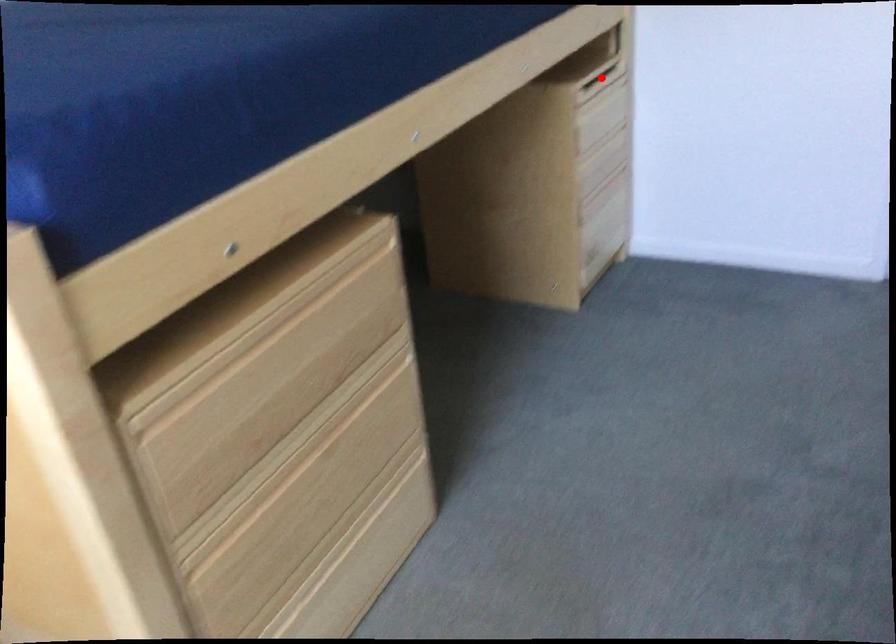
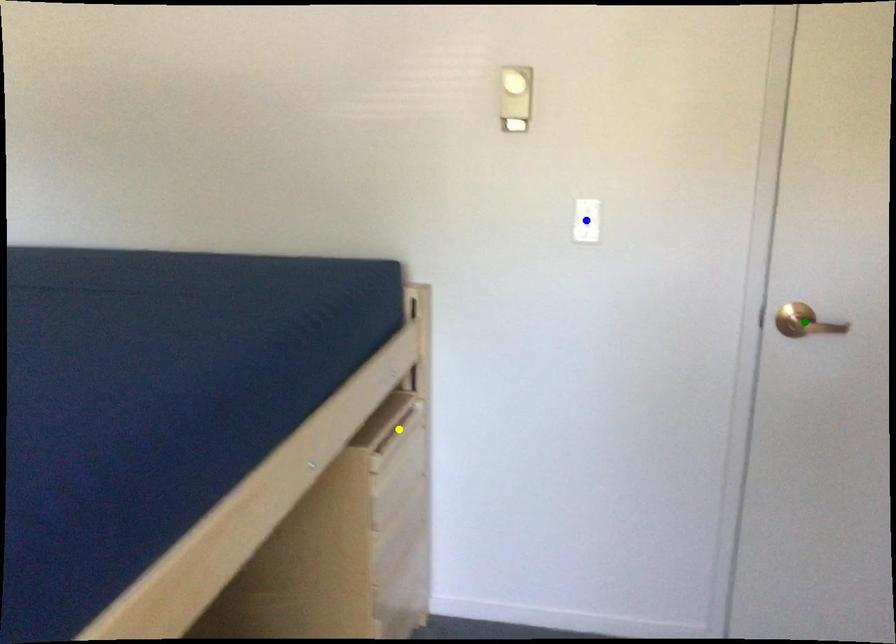
Question: I am providing you with two images of the same scene from different viewpoints. A red point is marked on the first image. You are given multiple points on the second image. Which point in image 2 represents the same 3d spot as the red point in image 1?

Choices:
 (A) yellow point
 (B) green point
 (C) blue point

Answer: (A)